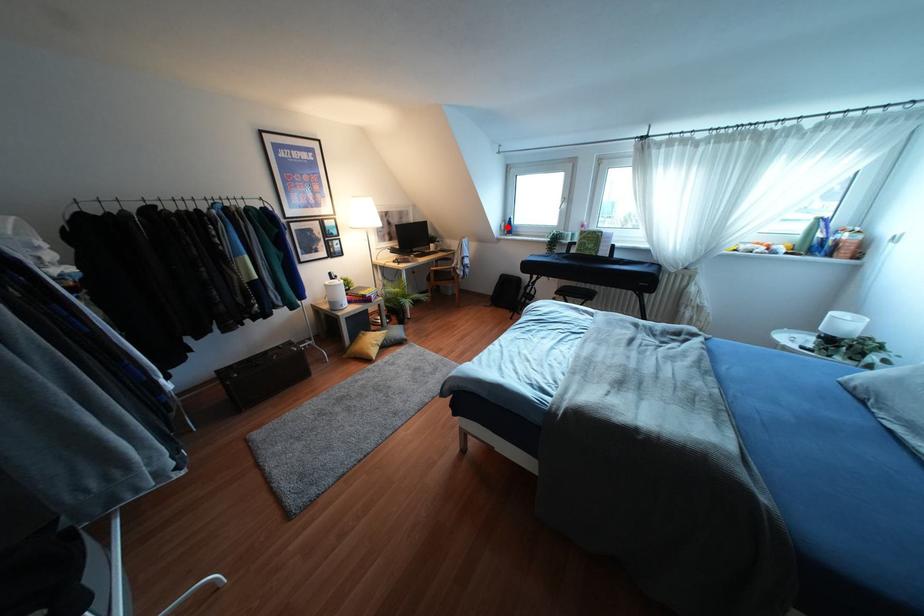
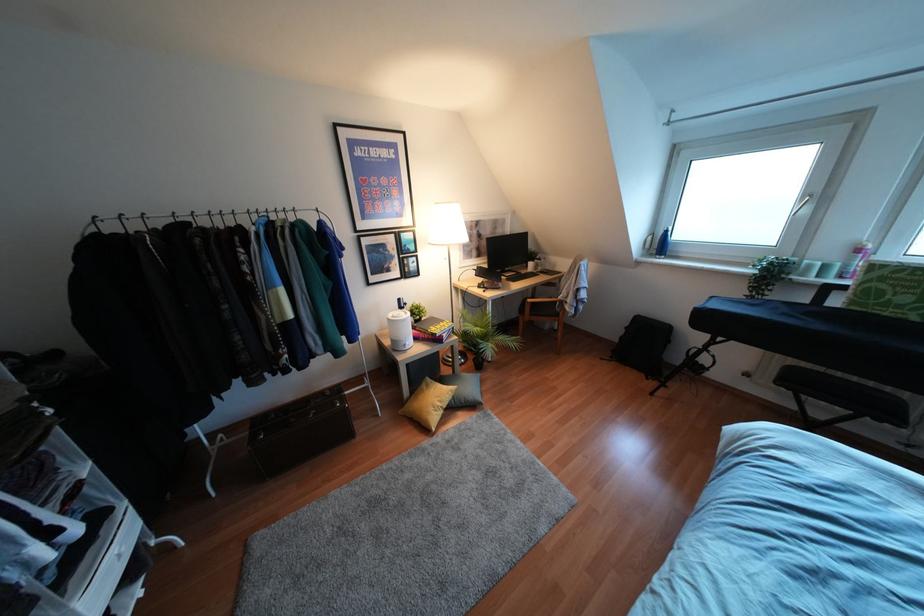
In the second image, find the point that corresponds to the highlighted location in the first image.

(660, 245)